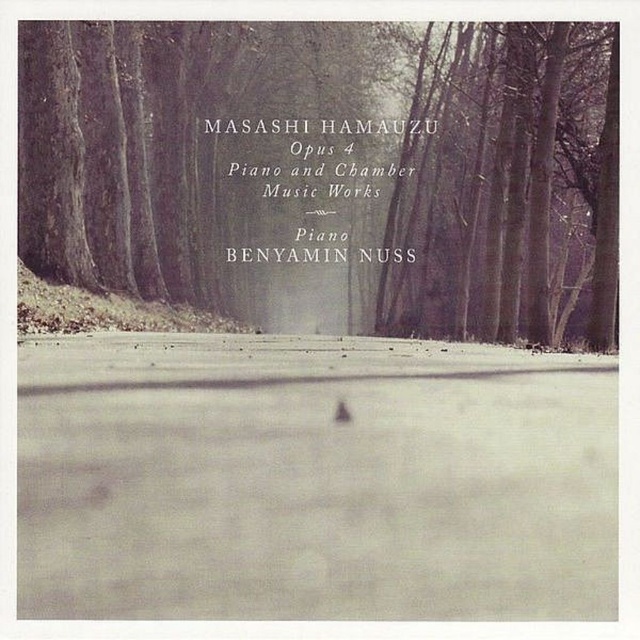
Which is in front, point (486, 236) or point (541, 170)?

Point (541, 170) is more forward.

Can you confirm if smooth bark tree at center is bigger than smooth bark tree at upper right?

No, smooth bark tree at center is not bigger than smooth bark tree at upper right.

I want to click on smooth bark tree at center, so click(x=326, y=164).